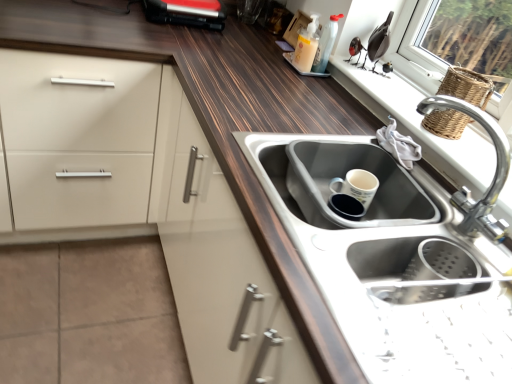
Question: Could you tell me if wooden window sill at upper right is facing translucent plastic soap dispenser at upper center, which is the second bottle from right to left?

Choices:
 (A) yes
 (B) no

Answer: (B)

Question: Can we say wooden window sill at upper right lies outside translucent plastic soap dispenser at upper center, which is counted as the 1th bottle, starting from the left?

Choices:
 (A) no
 (B) yes

Answer: (B)

Question: Considering the relative positions of wooden window sill at upper right and translucent plastic soap dispenser at upper center, which is the second bottle from right to left, in the image provided, is wooden window sill at upper right to the left of translucent plastic soap dispenser at upper center, which is the second bottle from right to left, from the viewer's perspective?

Choices:
 (A) yes
 (B) no

Answer: (B)

Question: Is wooden window sill at upper right turned away from translucent plastic soap dispenser at upper center, which is the second bottle from right to left?

Choices:
 (A) yes
 (B) no

Answer: (B)

Question: Is wooden window sill at upper right closer to camera compared to translucent plastic soap dispenser at upper center, which is the second bottle from right to left?

Choices:
 (A) no
 (B) yes

Answer: (B)

Question: From their relative heights in the image, would you say translucent plastic soap dispenser at upper center, which is counted as the 1th bottle, starting from the left, is taller or shorter than woven brown basket at upper right?

Choices:
 (A) tall
 (B) short

Answer: (B)

Question: Considering the positions of point (303, 49) and point (480, 104), is point (303, 49) closer or farther from the camera than point (480, 104)?

Choices:
 (A) farther
 (B) closer

Answer: (A)

Question: Looking at the image, does translucent plastic soap dispenser at upper center, which is counted as the 1th bottle, starting from the left, seem bigger or smaller compared to woven brown basket at upper right?

Choices:
 (A) small
 (B) big

Answer: (A)

Question: Choose the correct answer: Is translucent plastic soap dispenser at upper center, which is counted as the 1th bottle, starting from the left, inside woven brown basket at upper right or outside it?

Choices:
 (A) inside
 (B) outside

Answer: (B)

Question: Is woven brown basket at upper right taller or shorter than translucent plastic soap dispenser at upper center, which is the second bottle from right to left?

Choices:
 (A) short
 (B) tall

Answer: (B)

Question: Is woven brown basket at upper right bigger or smaller than translucent plastic soap dispenser at upper center, which is the second bottle from right to left?

Choices:
 (A) small
 (B) big

Answer: (B)

Question: From the image's perspective, is woven brown basket at upper right above or below translucent plastic soap dispenser at upper center, which is counted as the 1th bottle, starting from the left?

Choices:
 (A) below
 (B) above

Answer: (A)

Question: Is woven brown basket at upper right situated inside translucent plastic soap dispenser at upper center, which is counted as the 1th bottle, starting from the left, or outside?

Choices:
 (A) outside
 (B) inside

Answer: (A)

Question: Is translucent plastic bottle at upper right, the 1th bottle from the right, inside the boundaries of wooden window sill at upper right, or outside?

Choices:
 (A) outside
 (B) inside

Answer: (A)

Question: From a real-world perspective, relative to wooden window sill at upper right, is translucent plastic bottle at upper right, the 1th bottle from the right, vertically above or below?

Choices:
 (A) below
 (B) above

Answer: (B)